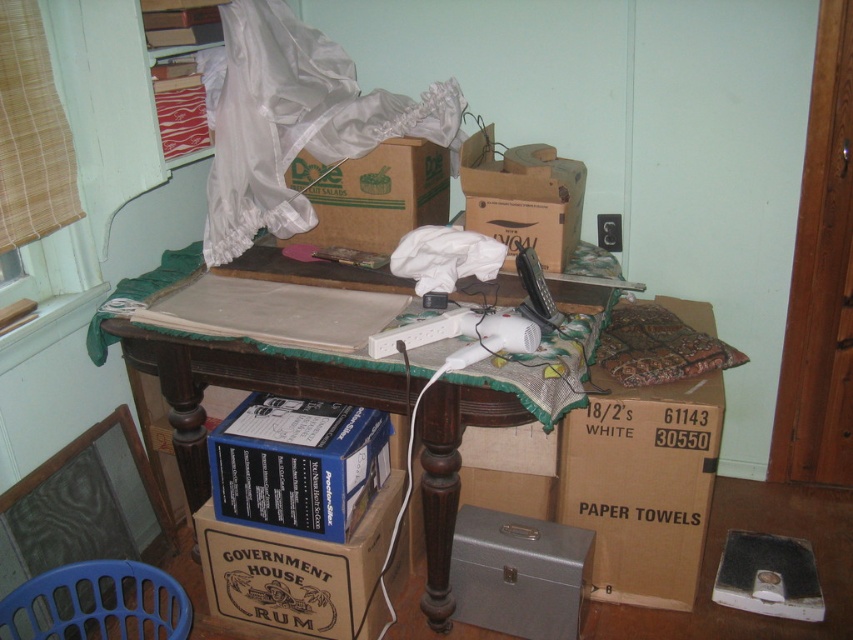
You are helping to organize the storage room and need to place a new box that is 12 inches wide. The blue cardboard box at lower center and the brown cardboard box at upper center are already in place. Which existing box should you consider moving to accommodate the new box?

The blue cardboard box at lower center is smaller than the brown cardboard box at upper center, so moving the smaller blue cardboard box at lower center would free up more space to accommodate the new 12 inch wide box.

You are helping to organize the storage area and need to place a new box that is 20 cm tall. Which of the two boxes, the brown cardboard paper towels at lower right or the brown cardboard box at upper center, can accommodate the new box on top of it without exceeding height restrictions?

The brown cardboard paper towels at lower right is taller than the brown cardboard box at upper center. Since the new box is 20 cm tall, it can be placed on top of the brown cardboard box at upper center as long as its height does not exceed the total allowed height. However, without knowing the total height limit, we can only state that the brown cardboard paper towels at lower right is taller, so it might be a better option if height is a concern.

You are trying to decide which item to move first. Since you want to move the lighter object first, which one should you choose between the brown cardboard paper towels at lower right and the metallic gray toolbox at lower center?

The brown cardboard paper towels at lower right is bigger than the metallic gray toolbox at lower center. However, size does not always correlate with weight. Since the toolbox is metallic, it might be heavier despite being smaller. Therefore, the brown cardboard paper towels at lower right is likely the lighter option and should be moved first.